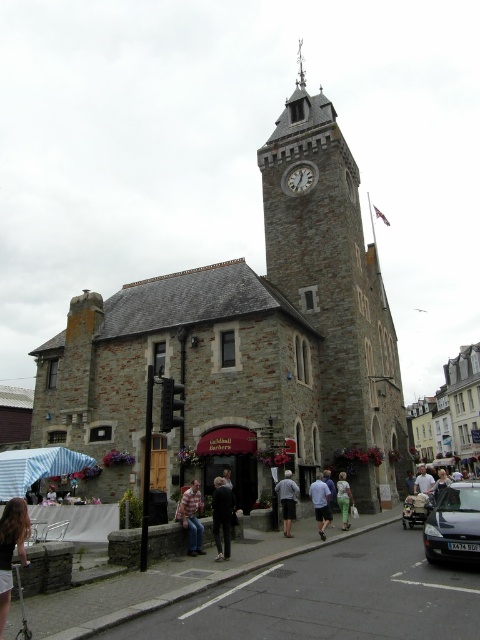
From the picture: You are standing in the town square in front of the historic stone building with the clock tower. You notice a striped shirt at center. Where exactly is the striped shirt located in relation to the building?

The striped shirt at center is located at point 0.809 on the x axis and 0.400 on the y axis relative to the building.

You are standing in the town square looking at the historic stone building. You see a white stone clock at center and a light blue shirt at center. Which object is closer to you?

The white stone clock at center is closer to you than the light blue shirt at center.